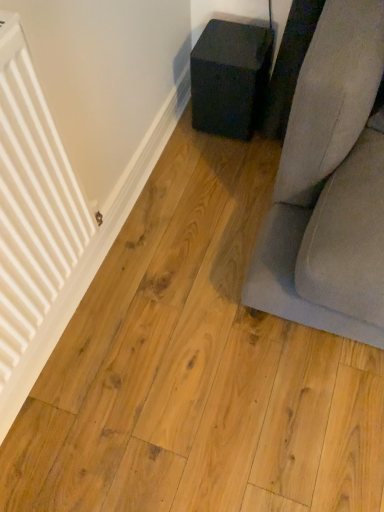
Question: Does white matte radiator at left have a smaller size compared to matte black cube at center?

Choices:
 (A) yes
 (B) no

Answer: (B)

Question: Is white matte radiator at left taller than matte black cube at center?

Choices:
 (A) no
 (B) yes

Answer: (B)

Question: From the image's perspective, is white matte radiator at left on top of matte black cube at center?

Choices:
 (A) no
 (B) yes

Answer: (A)

Question: Can you confirm if white matte radiator at left is bigger than matte black cube at center?

Choices:
 (A) yes
 (B) no

Answer: (A)

Question: From the image's perspective, is white matte radiator at left beneath matte black cube at center?

Choices:
 (A) no
 (B) yes

Answer: (B)

Question: Is white matte radiator at left looking in the opposite direction of matte black cube at center?

Choices:
 (A) no
 (B) yes

Answer: (A)

Question: Considering the relative positions of matte black cube at center and white matte radiator at left in the image provided, is matte black cube at center to the left of white matte radiator at left from the viewer's perspective?

Choices:
 (A) yes
 (B) no

Answer: (B)

Question: Is matte black cube at center facing away from white matte radiator at left?

Choices:
 (A) yes
 (B) no

Answer: (B)

Question: From a real-world perspective, is matte black cube at center below white matte radiator at left?

Choices:
 (A) no
 (B) yes

Answer: (B)

Question: Considering the relative positions of matte black cube at center and white matte radiator at left in the image provided, is matte black cube at center in front of white matte radiator at left?

Choices:
 (A) yes
 (B) no

Answer: (B)

Question: Is white matte radiator at left surrounded by matte black cube at center?

Choices:
 (A) no
 (B) yes

Answer: (A)

Question: Can you confirm if matte black cube at center is thinner than white matte radiator at left?

Choices:
 (A) yes
 (B) no

Answer: (B)

Question: From a real-world perspective, is white matte radiator at left physically located above or below matte black cube at center?

Choices:
 (A) above
 (B) below

Answer: (A)